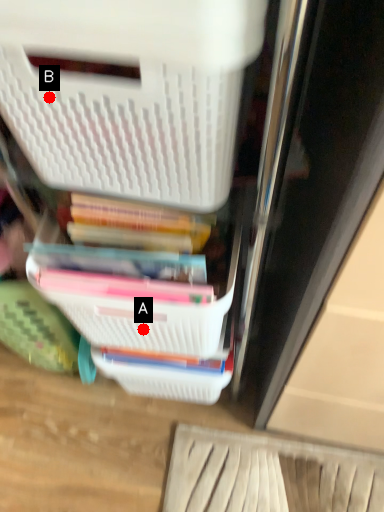
Question: Two points are circled on the image, labeled by A and B beside each circle. Among these points, which one is nearest to the camera?

Choices:
 (A) A is closer
 (B) B is closer

Answer: (B)